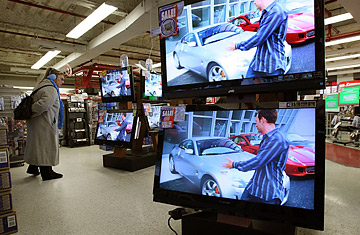
At what (x,y) coordinates should I click in order to perform the action: click on lights. Please return your answer as a coordinate pair (x, y). The image size is (360, 235). Looking at the image, I should click on (43, 58), (93, 19), (331, 19), (341, 41), (342, 57), (346, 67), (159, 66).